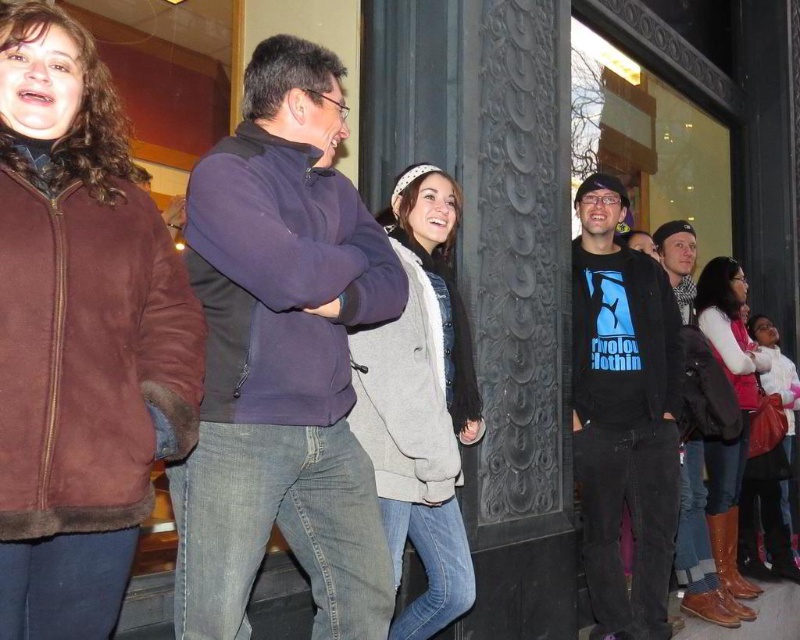
Question: Which of the following is the closest to the observer?

Choices:
 (A) (701, 500)
 (B) (38, 566)

Answer: (B)

Question: Can you confirm if brown leather jacket at right is positioned to the left of brown leather boots at lower right?

Choices:
 (A) no
 (B) yes

Answer: (B)

Question: Can you confirm if brown suede jacket at left is positioned below light gray fleece jacket at center?

Choices:
 (A) no
 (B) yes

Answer: (A)

Question: Which point is closer to the camera?

Choices:
 (A) white fleece jacket at lower right
 (B) brown leather jacket at right
 (C) black matte t-shirt at center
 (D) dark blue fleece at center

Answer: (D)

Question: Which of the following is the closest to the observer?

Choices:
 (A) [222, 376]
 (B) [766, 502]
 (C) [708, 317]

Answer: (A)

Question: Can you confirm if black matte t-shirt at center is thinner than brown leather jacket at right?

Choices:
 (A) yes
 (B) no

Answer: (A)